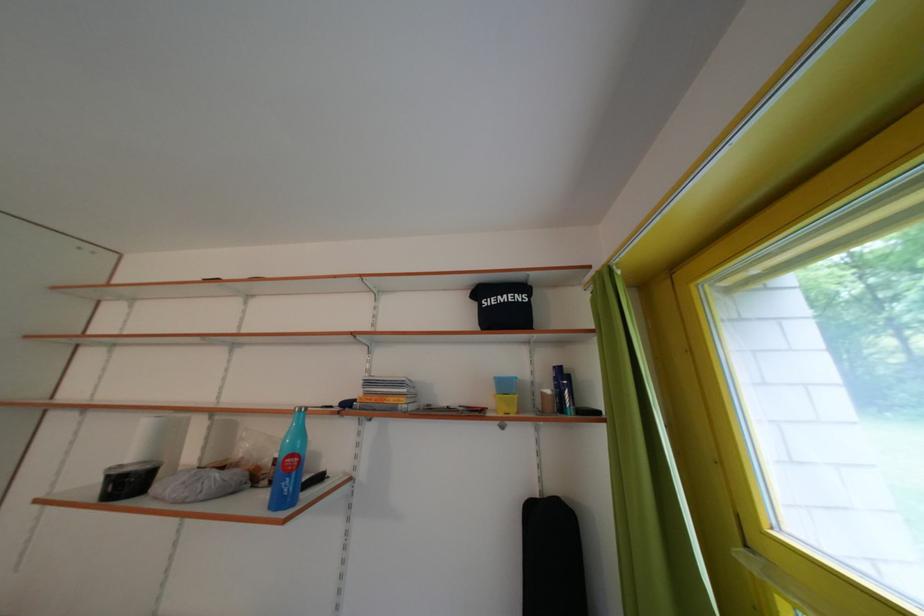
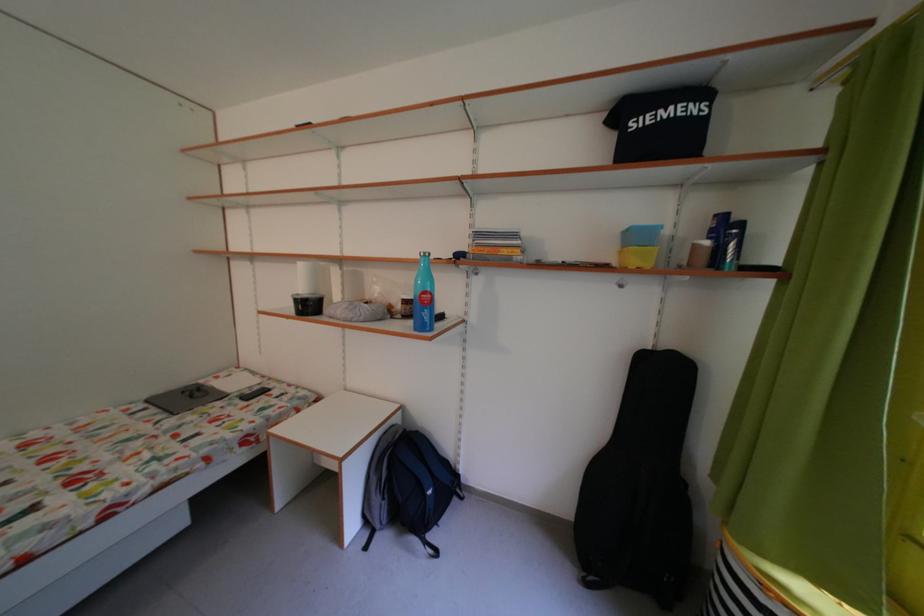
Find the pixel in the second image that matches (x=118, y=483) in the first image.

(306, 306)